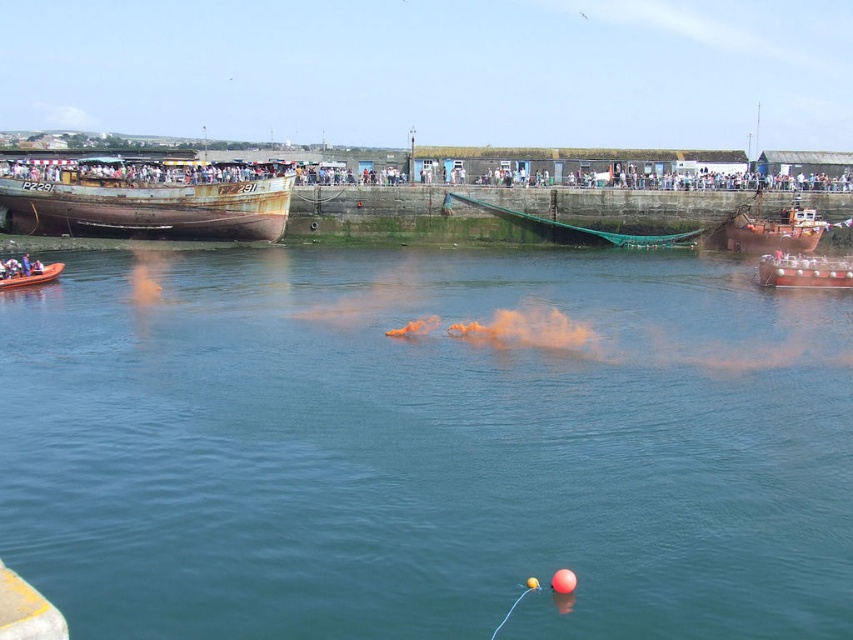
Question: Does matte black boat at upper center have a smaller size compared to rusty metal boat at right?

Choices:
 (A) no
 (B) yes

Answer: (A)

Question: Which object appears farthest from the camera in this image?

Choices:
 (A) rusty metal boat at right
 (B) brushed metal boat at lower left
 (C) matte black boat at upper center

Answer: (C)

Question: Which point appears closest to the camera in this image?

Choices:
 (A) (28, 179)
 (B) (561, 593)
 (C) (842, 275)

Answer: (B)

Question: Based on their relative distances, which object is nearer to the metallic silver boat at right?

Choices:
 (A) orange rubber balloon at center
 (B) orange smoke at center

Answer: (B)

Question: Can you confirm if matte black boat at upper center is wider than orange rubber balloon at center?

Choices:
 (A) no
 (B) yes

Answer: (B)

Question: Observing the image, what is the correct spatial positioning of matte black boat at upper center in reference to rusty metal boat at right?

Choices:
 (A) above
 (B) below

Answer: (A)